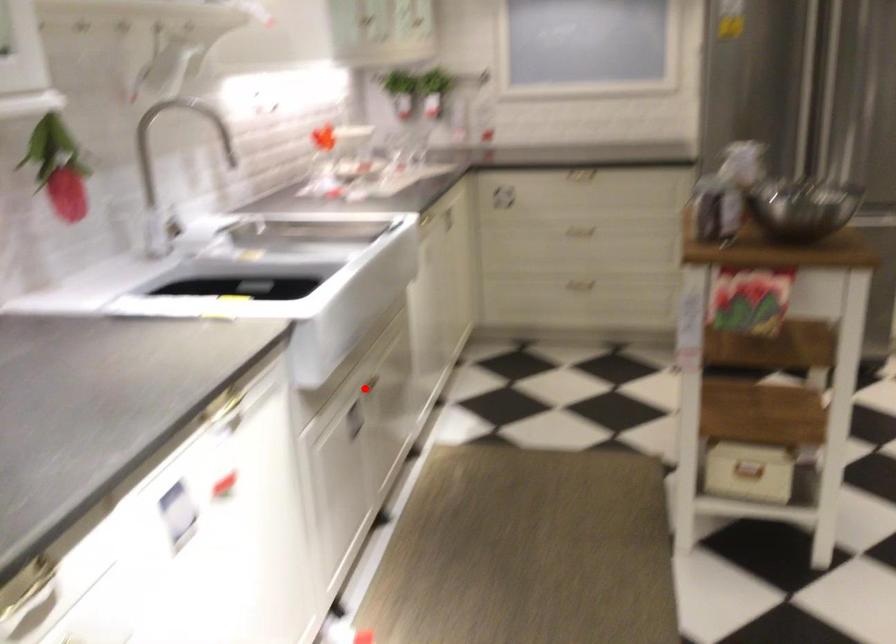
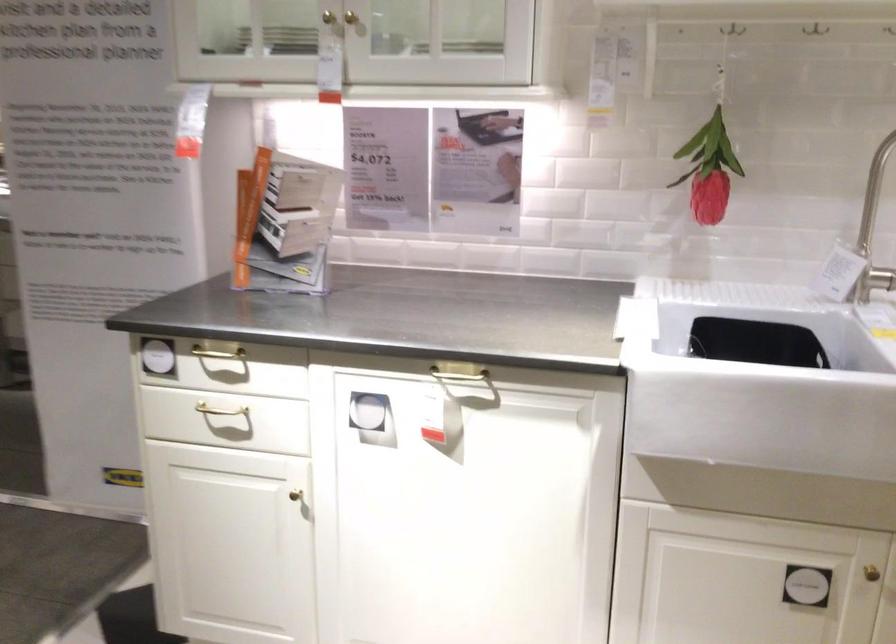
Question: A red point is marked in image1. In image2, is the corresponding 3D point closer to the camera or farther? Reply with the corresponding letter.

Choices:
 (A) The corresponding 3D point is closer.
 (B) The corresponding 3D point is farther.

Answer: (A)